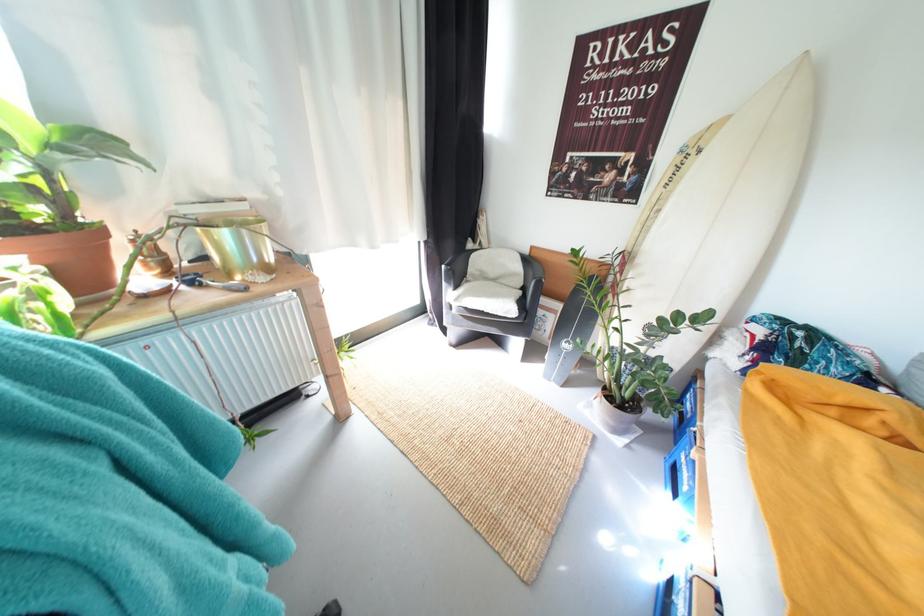
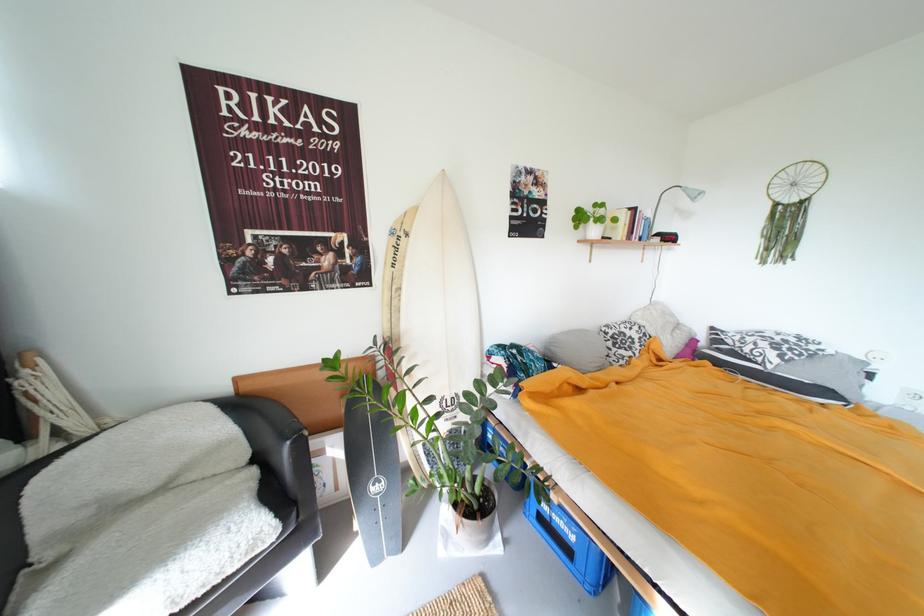
The point at (x=655, y=225) is marked in the first image. Where is the corresponding point in the second image?

(402, 306)